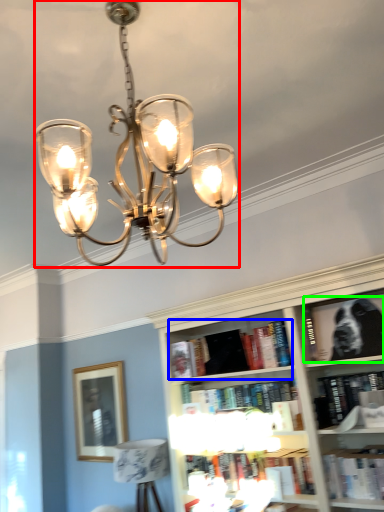
Question: Considering the real-world distances, which object is closest to lamp (highlighted by a red box)? book (highlighted by a blue box) or book (highlighted by a green box).

Choices:
 (A) book
 (B) book

Answer: (B)